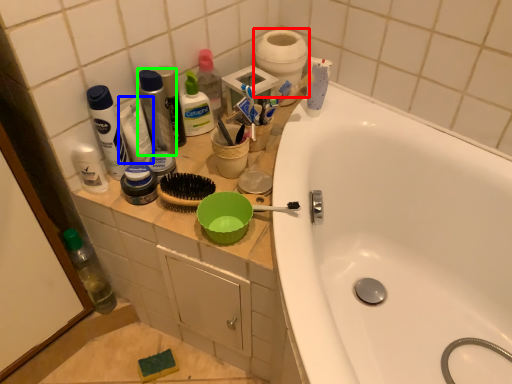
Question: Which object is the farthest from toilet paper (highlighted by a red box)? Choose among these: toothpaste (highlighted by a blue box) or mouthwash (highlighted by a green box).

Choices:
 (A) toothpaste
 (B) mouthwash

Answer: (A)